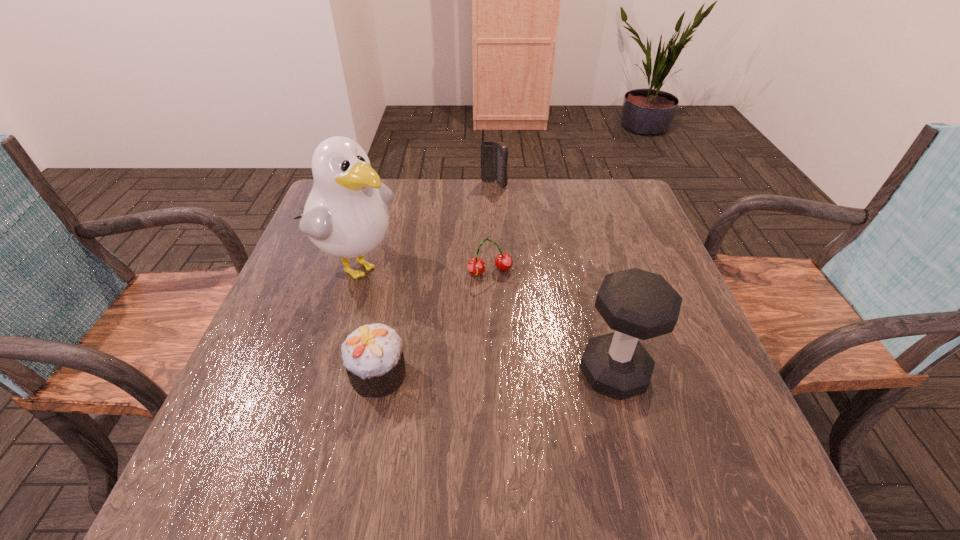
At what (x,y) coordinates should I click in order to perform the action: click on the closest object to the cellular telephone. Please return your answer as a coordinate pair (x, y). Looking at the image, I should click on (346, 215).

Identify which object is the second closest to the cellular telephone. Please provide its 2D coordinates. Your answer should be formatted as a tuple, i.e. [(x, y)], where the tuple contains the x and y coordinates of a point satisfying the conditions above.

[(476, 266)]

At what (x,y) coordinates should I click in order to perform the action: click on blank space that satisfies the following two spatial constraints: 1. on the front side of the tallest object; 2. on the left side of the dumbbell. Please return your answer as a coordinate pair (x, y). This screenshot has height=540, width=960. Looking at the image, I should click on (321, 373).

Find the location of a particular element. Image resolution: width=960 pixels, height=540 pixels. blank space that satisfies the following two spatial constraints: 1. on the back side of the tallest object; 2. on the left side of the farthest object is located at coordinates [380, 184].

I want to click on vacant space that satisfies the following two spatial constraints: 1. on the back side of the rightmost object; 2. on the right side of the cupcake, so click(x=378, y=373).

Locate an element on the screen. vacant space that satisfies the following two spatial constraints: 1. on the back side of the cupcake; 2. on the right side of the cherry is located at coordinates (398, 272).